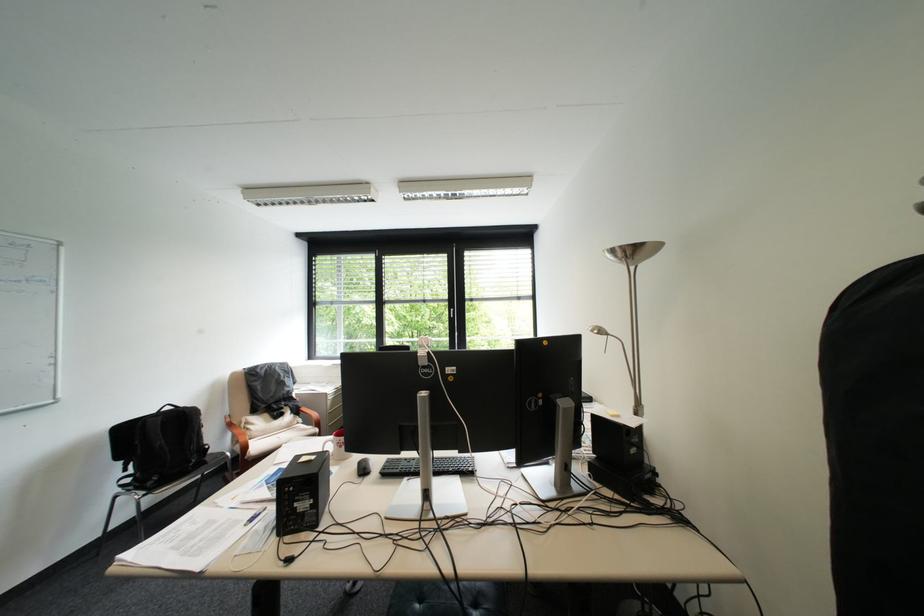
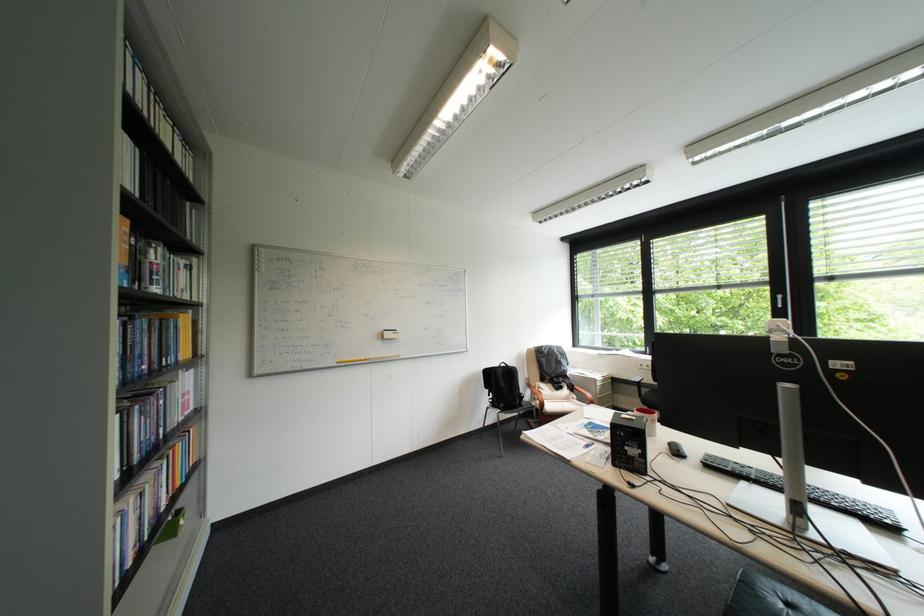
Find the pixel in the second image that matches (293,419) in the first image.

(573, 391)